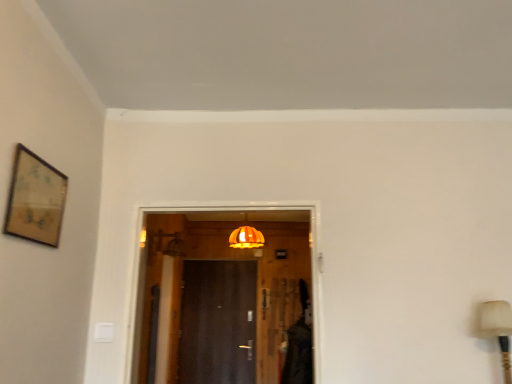
Question: Looking at their shapes, would you say matte beige table lamp at right is wider or thinner than wooden framed artwork at upper left?

Choices:
 (A) wide
 (B) thin

Answer: (A)

Question: In the image, is matte beige table lamp at right positioned in front of or behind wooden framed artwork at upper left?

Choices:
 (A) front
 (B) behind

Answer: (B)

Question: Which of these objects is positioned farthest from the wooden framed artwork at upper left?

Choices:
 (A) dark wood door at center
 (B) orange fabric lampshade at center
 (C) matte beige table lamp at right

Answer: (A)

Question: Estimate the real-world distances between objects in this image. Which object is farther from the matte beige table lamp at right?

Choices:
 (A) dark wood door at center
 (B) orange fabric lampshade at center
 (C) wooden framed artwork at upper left

Answer: (A)